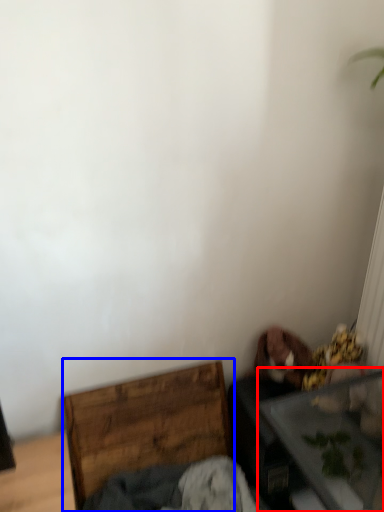
Question: Which object appears farthest to the camera in this image, table (highlighted by a red box) or furniture (highlighted by a blue box)?

Choices:
 (A) table
 (B) furniture

Answer: (B)